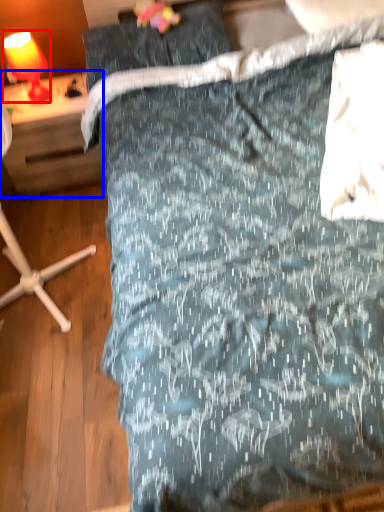
Question: Which object appears farthest to the camera in this image, lamp (highlighted by a red box) or desk (highlighted by a blue box)?

Choices:
 (A) lamp
 (B) desk

Answer: (B)